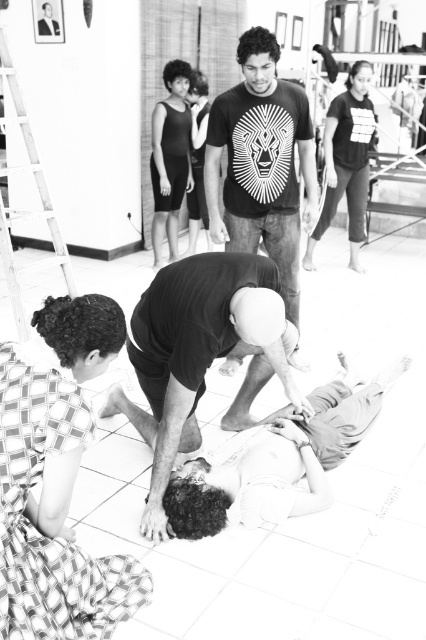
Consider the image. You are a photographer trying to capture a closeup of the black matte shirt at center and the matte black dress at upper left. Since you want both subjects to appear the same size in the photo, which one should you move closer to the camera?

Since the black matte shirt at center is wider than the matte black dress at upper left, you should move the matte black dress at upper left closer to the camera to make them appear the same size in the photo.

You are a photographer trying to capture a photo of the matte black dress at upper left and the matte black shirt at upper center. If you want to ensure both are fully visible in your frame, which object should you prioritize keeping closer to the camera?

The matte black dress at upper left might be wider than the matte black shirt at upper center, so you should prioritize keeping the matte black dress at upper left closer to the camera to ensure it fits within the frame.